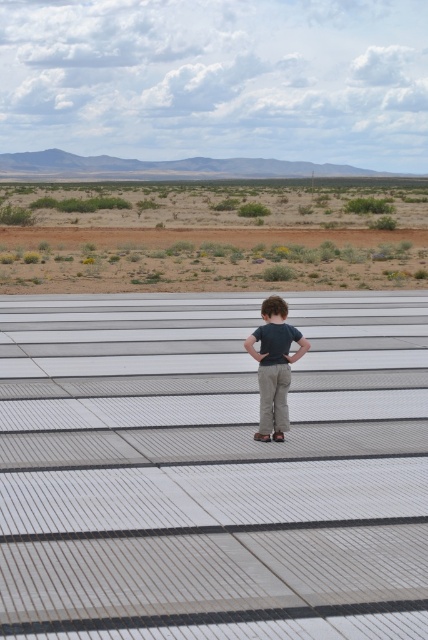
Does desert shrubs at lower center appear under matte khaki pants at center?

No.

Is desert shrubs at lower center behind matte khaki pants at center?

Yes.

Who is more forward, [220,212] or [276,417]?

Point [276,417] is in front.

You are a GUI agent. You are given a task and a screenshot of the screen. Output one action in this format:
    pyautogui.click(x=<x>, y=<y>)
    Task: Click on the desert shrubs at lower center
    
    Given the screenshot: What is the action you would take?
    pyautogui.click(x=213, y=237)